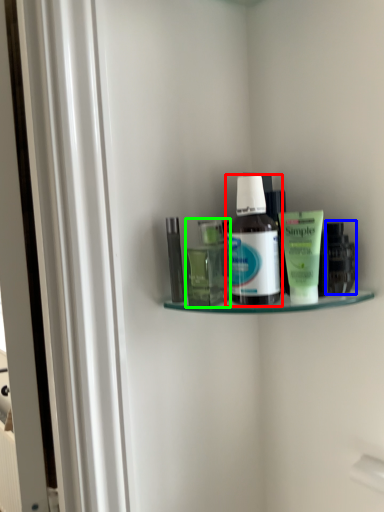
Question: Considering the real-world distances, which object is farthest from bottle (highlighted by a red box)? toiletry (highlighted by a blue box) or toiletry (highlighted by a green box)?

Choices:
 (A) toiletry
 (B) toiletry

Answer: (A)